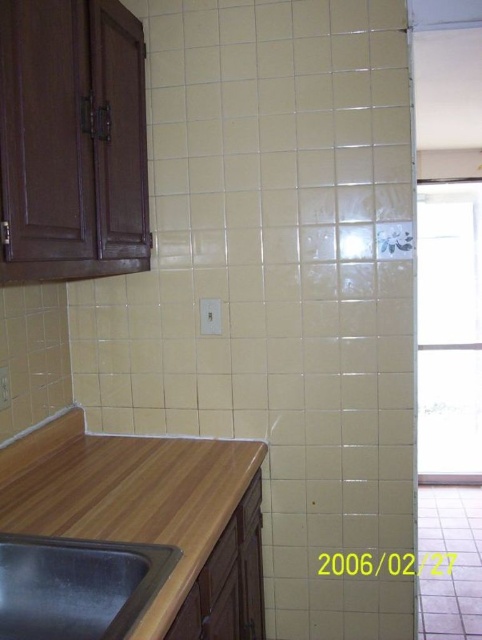
Question: Can you confirm if wooden counter at lower left is bigger than black stainless steel sink at lower left?

Choices:
 (A) yes
 (B) no

Answer: (A)

Question: In this image, where is wooden counter at lower left located relative to black stainless steel sink at lower left?

Choices:
 (A) below
 (B) above

Answer: (A)

Question: Can you confirm if wooden counter at lower left is positioned to the left of black stainless steel sink at lower left?

Choices:
 (A) yes
 (B) no

Answer: (B)

Question: Among these objects, which one is nearest to the camera?

Choices:
 (A) wooden counter at lower left
 (B) black stainless steel sink at lower left

Answer: (B)

Question: Which point is farther to the camera?

Choices:
 (A) black stainless steel sink at lower left
 (B) wooden counter at lower left

Answer: (B)